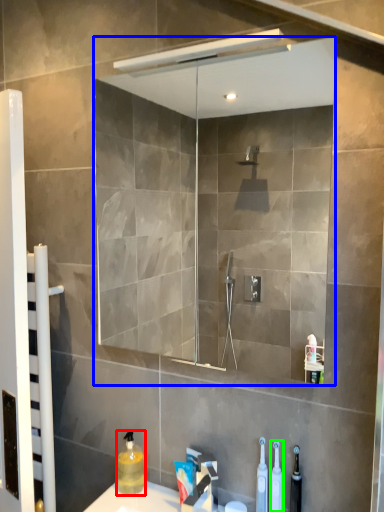
Question: Estimate the real-world distances between objects in this image. Which object is farther from cleaning product (highlighted by a red box), mirror (highlighted by a blue box) or cleaning product (highlighted by a green box)?

Choices:
 (A) mirror
 (B) cleaning product

Answer: (A)